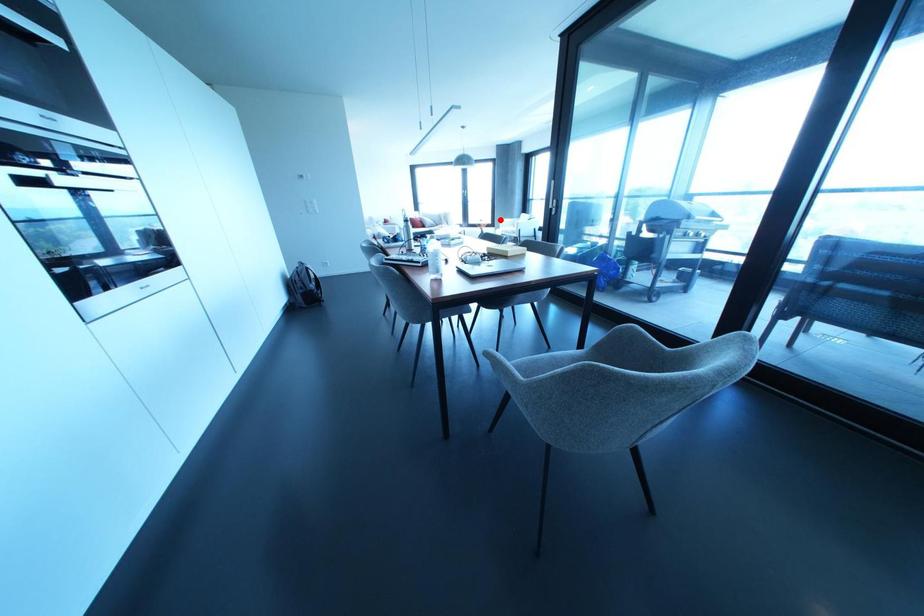
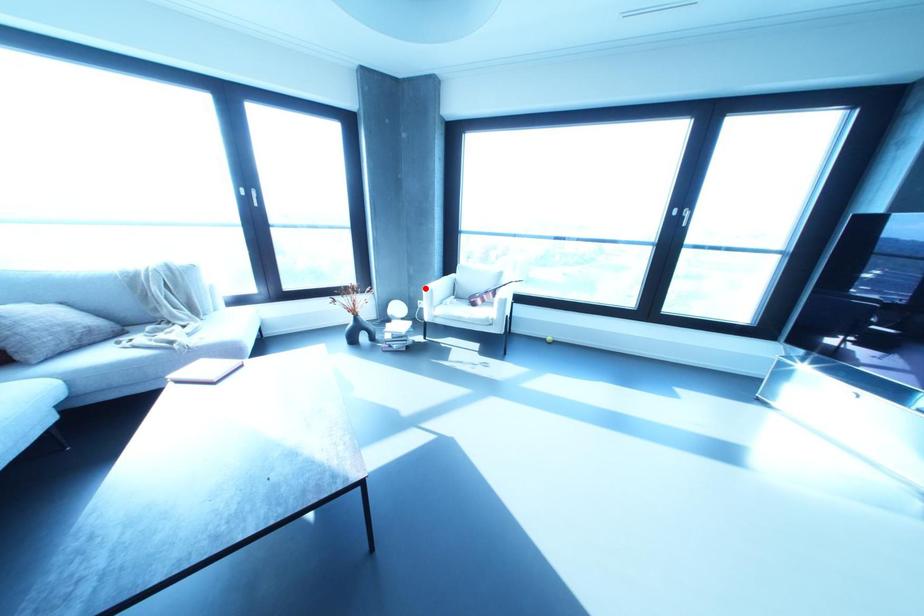
I am providing you with two images of the same scene from different viewpoints. A red point is marked on the first image and another point is marked on the second image. Is the red point in image1 aligned with the point shown in image2?

Yes